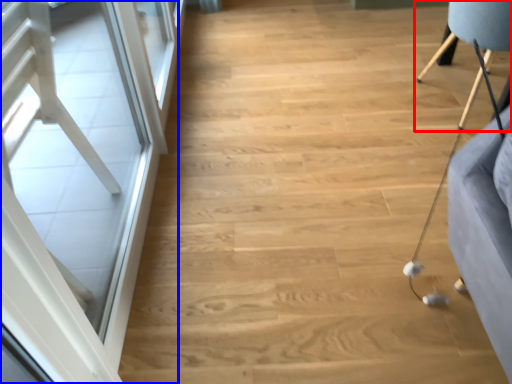
Question: Which object appears farthest to the camera in this image, furniture (highlighted by a red box) or screen door (highlighted by a blue box)?

Choices:
 (A) furniture
 (B) screen door

Answer: (A)